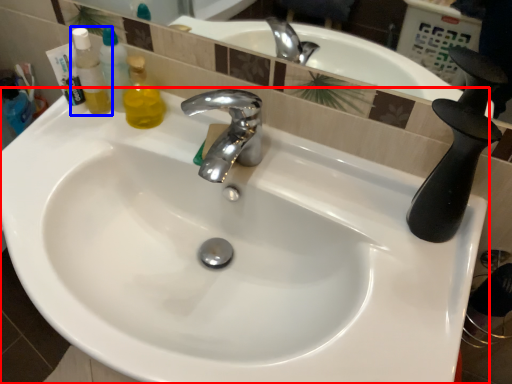
Question: Which point is closer to the camera, sink (highlighted by a red box) or mouthwash (highlighted by a blue box)?

Choices:
 (A) sink
 (B) mouthwash

Answer: (A)